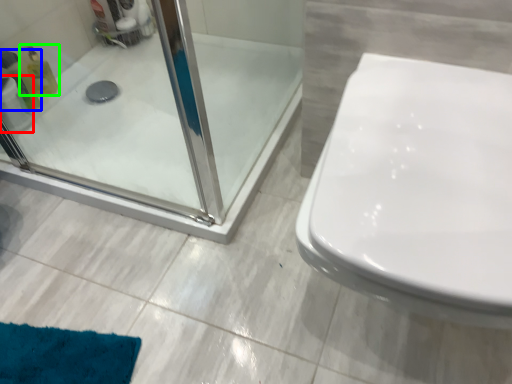
Question: Based on their relative distances, which object is farther from toilet paper (highlighted by a red box)? Choose from cleaning product (highlighted by a blue box) and cleaning product (highlighted by a green box).

Choices:
 (A) cleaning product
 (B) cleaning product

Answer: (B)